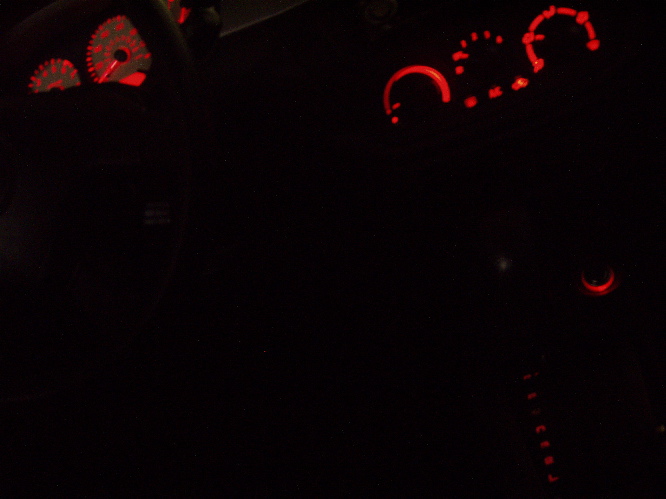
Find the location of `lights`. lights is located at coordinates (471, 99).